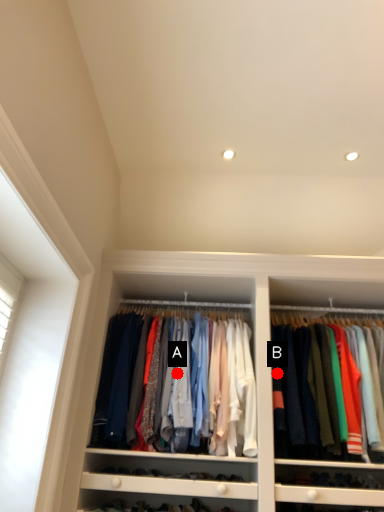
Question: Two points are circled on the image, labeled by A and B beside each circle. Which point appears farthest from the camera in this image?

Choices:
 (A) A is further
 (B) B is further

Answer: (B)